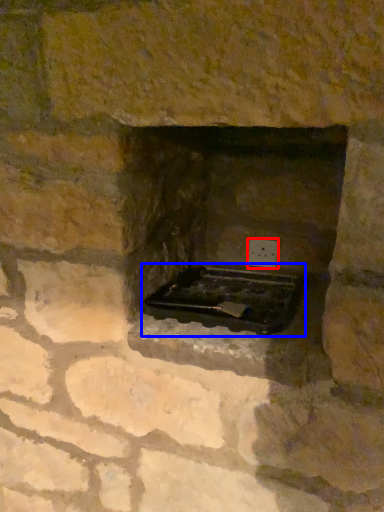
Question: Which object is further to the camera taking this photo, electric outlet (highlighted by a red box) or appliance (highlighted by a blue box)?

Choices:
 (A) electric outlet
 (B) appliance

Answer: (A)